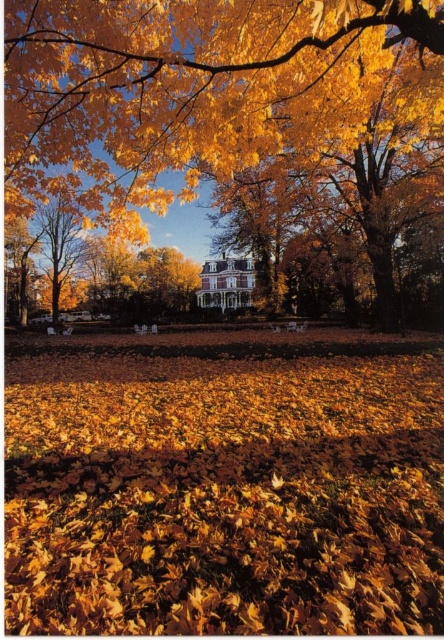
Question: Which object is closer to the camera taking this photo?

Choices:
 (A) golden textured leaves at center
 (B) shiny golden leaves at center

Answer: (B)

Question: Which point appears closest to the camera in this image?

Choices:
 (A) (87, 141)
 (B) (145, 410)

Answer: (B)

Question: Where is shiny golden leaves at center located in relation to golden textured leaves at center in the image?

Choices:
 (A) right
 (B) left

Answer: (A)

Question: Observing the image, what is the correct spatial positioning of shiny golden leaves at center in reference to golden textured leaves at center?

Choices:
 (A) left
 (B) right

Answer: (B)

Question: Does shiny golden leaves at center appear on the right side of golden textured leaves at center?

Choices:
 (A) yes
 (B) no

Answer: (A)